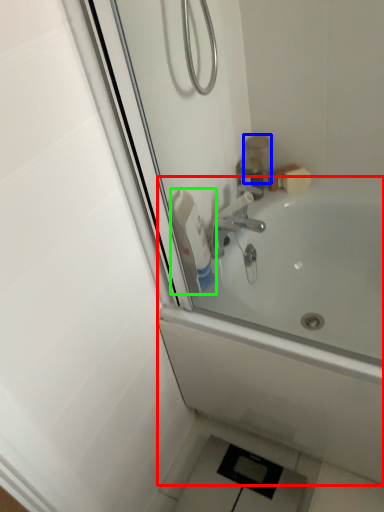
Question: Considering the real-world distances, which object is closest to bathtub (highlighted by a red box)? toiletry (highlighted by a blue box) or cleaning product (highlighted by a green box).

Choices:
 (A) toiletry
 (B) cleaning product

Answer: (B)